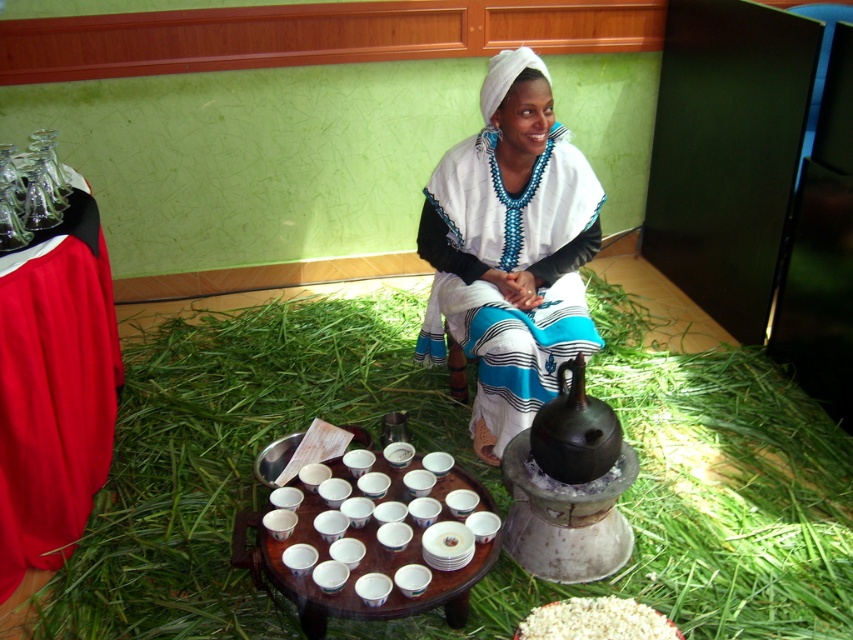
Question: Is green grassy hay at center behind black matte teapot at center?

Choices:
 (A) no
 (B) yes

Answer: (A)

Question: Among these points, which one is farthest from the camera?

Choices:
 (A) (242, 429)
 (B) (544, 288)

Answer: (A)

Question: Can you confirm if wooden table at center is positioned to the right of white matte rice at lower center?

Choices:
 (A) yes
 (B) no

Answer: (B)

Question: Is green grassy hay at center to the left of white woven cloth at center from the viewer's perspective?

Choices:
 (A) no
 (B) yes

Answer: (B)

Question: Which object is the farthest from the white matte rice at lower center?

Choices:
 (A) green grassy hay at center
 (B) black matte teapot at center
 (C) smooth red fabric at left

Answer: (C)

Question: Considering the real-world distances, which object is closest to the black matte teapot at center?

Choices:
 (A) white matte rice at lower center
 (B) green grassy hay at center
 (C) wooden table at center
 (D) white woven cloth at center

Answer: (C)